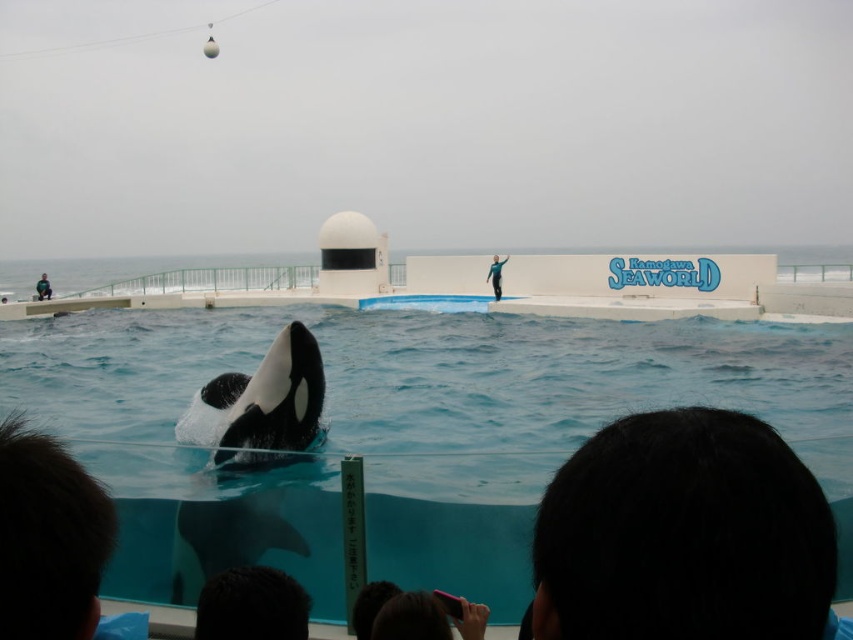
Which is more to the right, blue fabric at upper center or dark blue wetsuit at lower left?

blue fabric at upper center is more to the right.

Is blue fabric at upper center taller than dark blue wetsuit at lower left?

Yes.

Is point (490, 280) closer to viewer compared to point (42, 298)?

That is True.

The image size is (853, 640). What are the coordinates of `blue fabric at upper center` in the screenshot? It's located at (496, 275).

From the picture: Can you confirm if black smooth whale at center is taller than dark blue wetsuit at lower left?

Correct, black smooth whale at center is much taller as dark blue wetsuit at lower left.

Measure the distance from black smooth whale at center to dark blue wetsuit at lower left.

A distance of 82.26 feet exists between black smooth whale at center and dark blue wetsuit at lower left.

The width and height of the screenshot is (853, 640). I want to click on black smooth whale at center, so click(x=262, y=406).

Who is shorter, black hair at lower right or dark blue wetsuit at lower left?

Standing shorter between the two is black hair at lower right.

Does point (769, 588) come in front of point (41, 298)?

Yes, point (769, 588) is closer to viewer.

Locate an element on the screen. Image resolution: width=853 pixels, height=640 pixels. black hair at lower right is located at coordinates (683, 534).